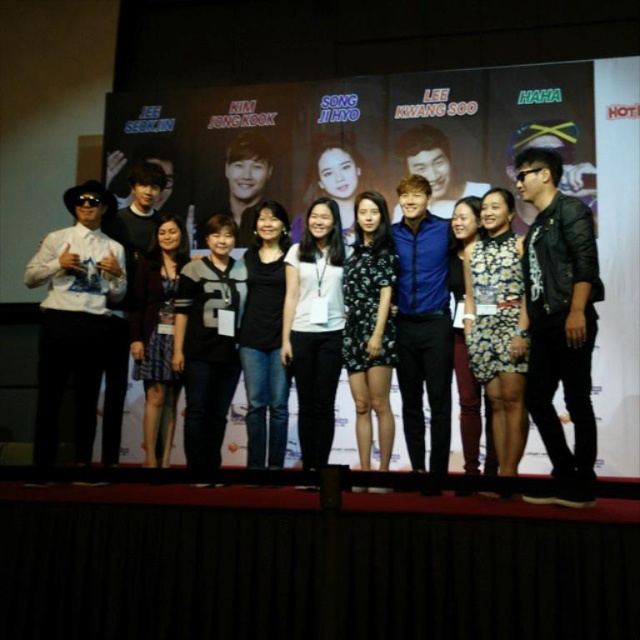
You are a photographer on the stage. You want to take a photo of the black jersey at center without the leather jacket at right blocking it. What should you do?

Move to the left side of the stage so that the black jersey at center is no longer behind the leather jacket at right.

You are standing in front of the stage and want to know which of the two points, point (477, 317) or point (540, 323), is closer to you. Based on the image, which one is nearer?

Point (477, 317) is further to the camera than point (540, 323), so the point closer to you is point (540, 323).